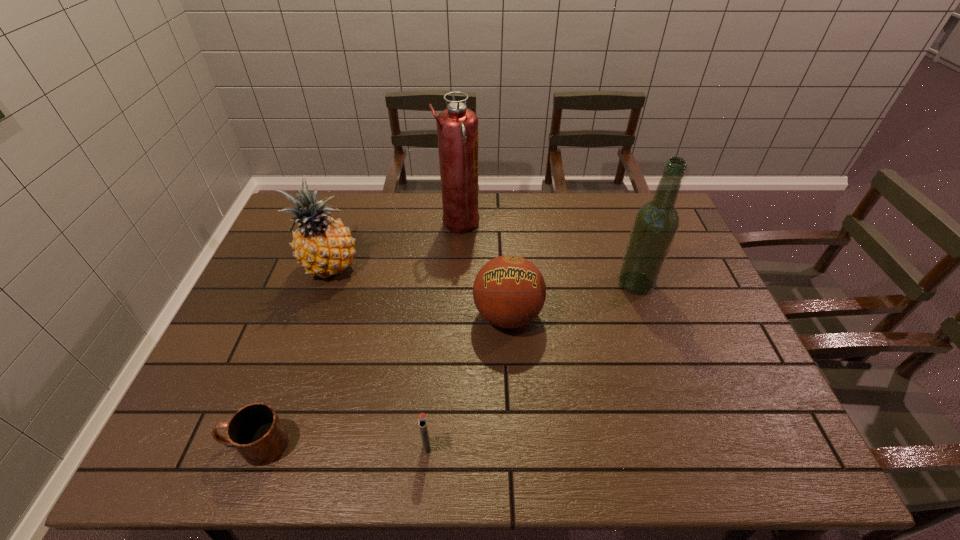
Identify the location of vacant space that's between the rightmost object and the fire extinguisher. (547, 254).

Where is `free spot between the fourth tallest object and the shortest object`? This screenshot has width=960, height=540. free spot between the fourth tallest object and the shortest object is located at coordinates (381, 380).

This screenshot has width=960, height=540. In order to click on the closest object to the shortest object in this screenshot , I will do `click(422, 420)`.

Select which object is the closest to the mug. Please provide its 2D coordinates. Your answer should be formatted as a tuple, i.e. [(x, y)], where the tuple contains the x and y coordinates of a point satisfying the conditions above.

[(422, 420)]

Image resolution: width=960 pixels, height=540 pixels. Find the location of `vacant space that satisfies the following two spatial constraints: 1. on the side of the fourth tallest object with the label; 2. on the right side of the fire extinguisher`. vacant space that satisfies the following two spatial constraints: 1. on the side of the fourth tallest object with the label; 2. on the right side of the fire extinguisher is located at coordinates (454, 315).

You are a GUI agent. You are given a task and a screenshot of the screen. Output one action in this format:
    pyautogui.click(x=<x>, y=<y>)
    Task: Click on the vacant space that satisfies the following two spatial constraints: 1. on the back side of the igniter; 2. on the side of the shortest object with the handle
    
    Given the screenshot: What is the action you would take?
    pyautogui.click(x=427, y=444)

I want to click on vacant space that satisfies the following two spatial constraints: 1. on the side of the second shortest object with the handle; 2. on the left side of the mug, so click(x=254, y=446).